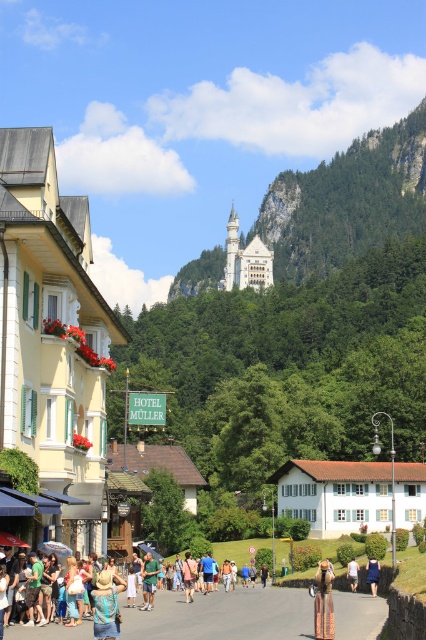
Question: Which object is positioned closest to the green fabric shirt at center?

Choices:
 (A) light blue denim shorts at center
 (B) blue dress at center
 (C) tan leather jacket at center
 (D) green forested mountain at upper center

Answer: (C)

Question: Estimate the real-world distances between objects in this image. Which object is farther from the light blue denim shorts at center?

Choices:
 (A) green forested mountain at upper center
 (B) light brown woven bag at center
 (C) denim shorts at lower left
 (D) green fabric shirt at center

Answer: (A)

Question: Is green forested mountain at upper center wider than tan leather jacket at center?

Choices:
 (A) no
 (B) yes

Answer: (B)

Question: Where is light brown woven bag at center located in relation to green fabric shirt at center in the image?

Choices:
 (A) right
 (B) left

Answer: (A)

Question: Which object is the closest to the denim shorts at lower left?

Choices:
 (A) tan leather jacket at center
 (B) green forested mountain at upper center
 (C) light brown woven bag at center

Answer: (A)

Question: Does tan leather jacket at center appear over light blue denim shorts at center?

Choices:
 (A) no
 (B) yes

Answer: (B)